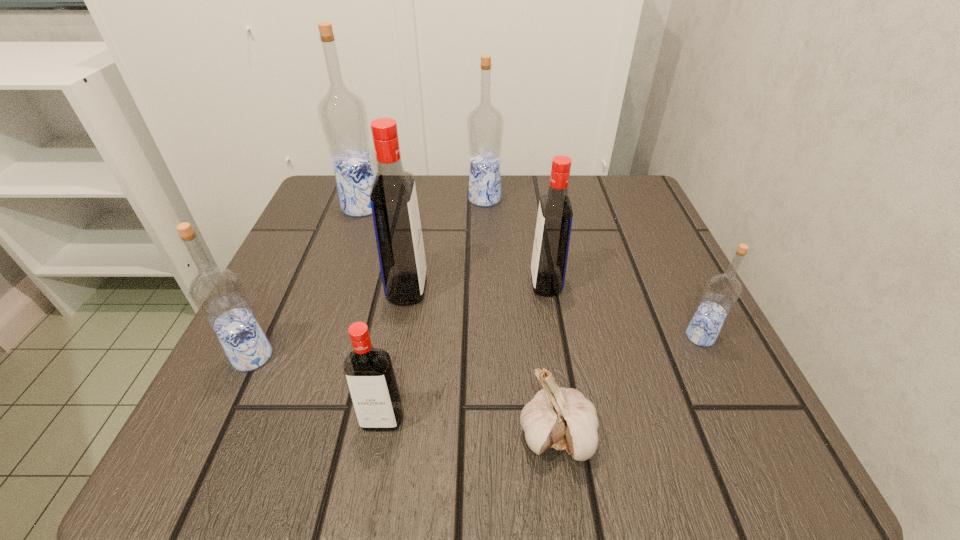
At what (x,y) coordinates should I click in order to perform the action: click on the smallest red vodka. Please return your answer as a coordinate pair (x, y). The height and width of the screenshot is (540, 960). Looking at the image, I should click on (369, 373).

Identify the location of the rightmost vodka. (722, 291).

Locate an element on the screen. the rightmost object is located at coordinates (722, 291).

Where is `the shortest object`? This screenshot has height=540, width=960. the shortest object is located at coordinates (562, 418).

Where is `free space located 0.050m on the right of the second blue vodka from left to right`? free space located 0.050m on the right of the second blue vodka from left to right is located at coordinates (405, 207).

This screenshot has height=540, width=960. I want to click on free space located on the right of the third smallest blue vodka, so click(x=564, y=199).

Image resolution: width=960 pixels, height=540 pixels. I want to click on vacant space located on the front and back of the biggest red vodka, so click(558, 289).

You are a GUI agent. You are given a task and a screenshot of the screen. Output one action in this format:
    pyautogui.click(x=<x>, y=<y>)
    Task: Click on the vacant area located on the front and back of the second biggest red vodka
    
    Given the screenshot: What is the action you would take?
    pyautogui.click(x=396, y=284)

At what (x,y) coordinates should I click in order to perform the action: click on free space located on the front and back of the second biggest red vodka. Please return your answer as a coordinate pair (x, y). The width and height of the screenshot is (960, 540). Looking at the image, I should click on (367, 284).

Identify the location of vacant region located on the front and back of the second biggest red vodka. (468, 284).